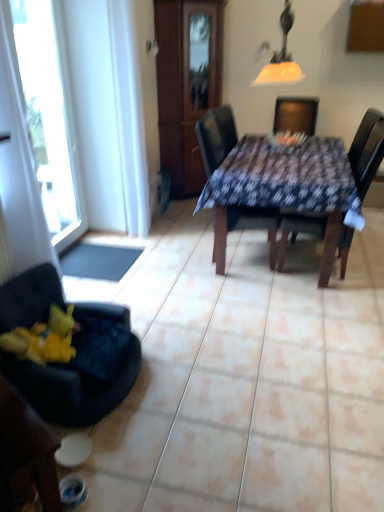
Question: From the image's perspective, is black rubber mat at lower left located beneath transparent glass window at left?

Choices:
 (A) yes
 (B) no

Answer: (A)

Question: Can you confirm if black rubber mat at lower left is thinner than transparent glass window at left?

Choices:
 (A) no
 (B) yes

Answer: (A)

Question: Is black rubber mat at lower left with transparent glass window at left?

Choices:
 (A) yes
 (B) no

Answer: (B)

Question: Is the position of black rubber mat at lower left more distant than that of transparent glass window at left?

Choices:
 (A) yes
 (B) no

Answer: (A)

Question: Does black rubber mat at lower left appear on the left side of transparent glass window at left?

Choices:
 (A) no
 (B) yes

Answer: (A)

Question: Considering the relative sizes of black rubber mat at lower left and transparent glass window at left in the image provided, is black rubber mat at lower left taller than transparent glass window at left?

Choices:
 (A) yes
 (B) no

Answer: (B)

Question: From the image's perspective, would you say black rubber mat at lower left is shown under matte yellow glass lampshade at upper center?

Choices:
 (A) no
 (B) yes

Answer: (B)

Question: Considering the relative sizes of black rubber mat at lower left and matte yellow glass lampshade at upper center in the image provided, is black rubber mat at lower left taller than matte yellow glass lampshade at upper center?

Choices:
 (A) yes
 (B) no

Answer: (B)

Question: Can you confirm if black rubber mat at lower left is smaller than matte yellow glass lampshade at upper center?

Choices:
 (A) no
 (B) yes

Answer: (B)

Question: From a real-world perspective, is black rubber mat at lower left beneath matte yellow glass lampshade at upper center?

Choices:
 (A) no
 (B) yes

Answer: (B)

Question: Does black rubber mat at lower left have a larger size compared to matte yellow glass lampshade at upper center?

Choices:
 (A) no
 (B) yes

Answer: (A)

Question: Is black rubber mat at lower left positioned in front of matte yellow glass lampshade at upper center?

Choices:
 (A) yes
 (B) no

Answer: (B)

Question: Is matte yellow glass lampshade at upper center facing towards wooden armoire at center?

Choices:
 (A) no
 (B) yes

Answer: (A)